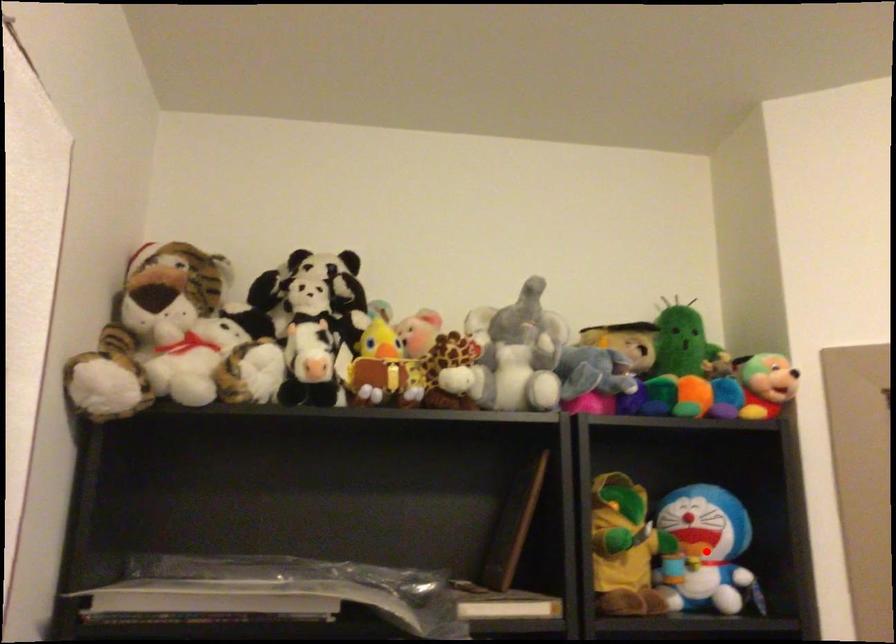
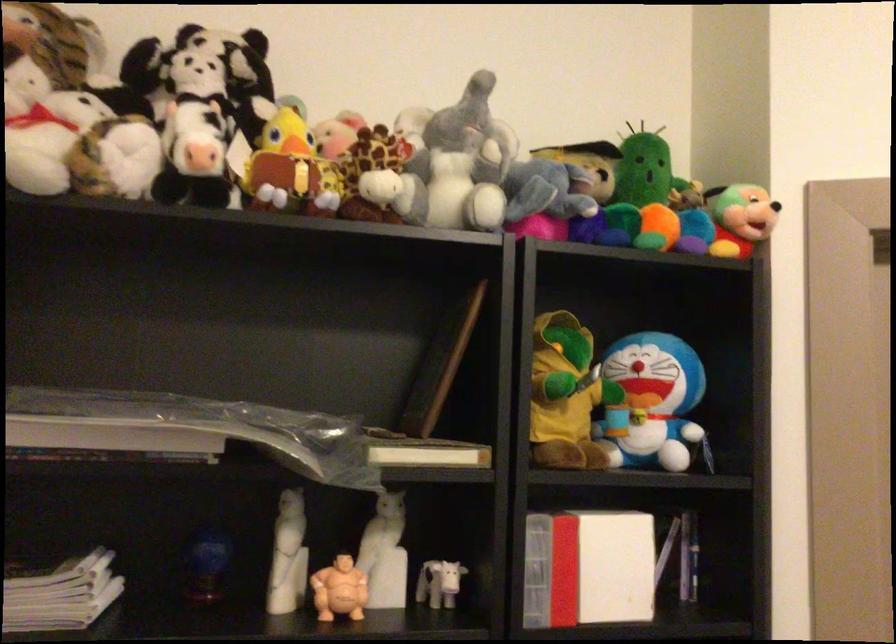
Question: I am providing you with two images of the same scene from different viewpoints. A red point is shown in image1. For the corresponding object point in image2, is it positioned nearer or farther from the camera?

Choices:
 (A) Nearer
 (B) Farther

Answer: (A)